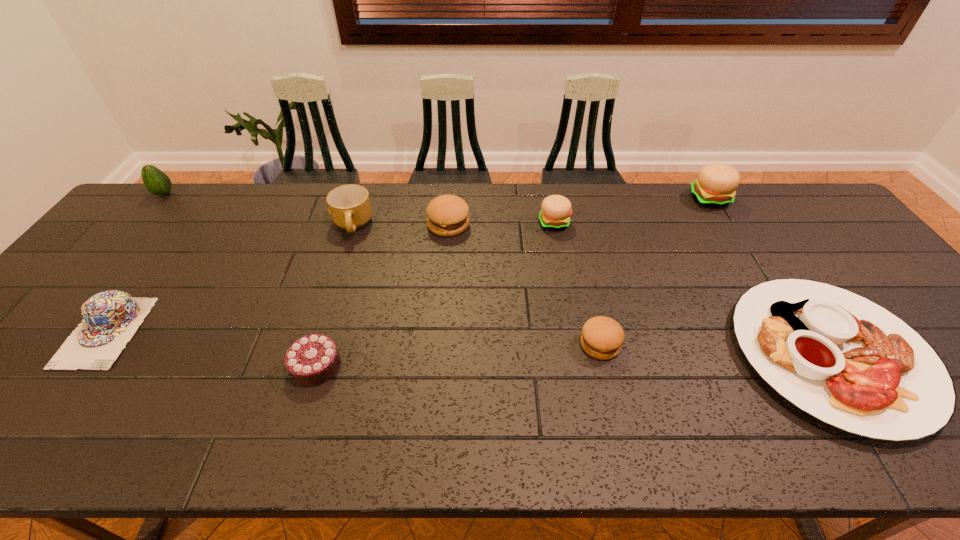
At what (x,y) coordinates should I click in order to perform the action: click on the right beige hamburger. Please return your answer as a coordinate pair (x, y). Looking at the image, I should click on (716, 184).

Find the location of a particular element. The width and height of the screenshot is (960, 540). the rightmost hamburger is located at coordinates (716, 184).

Find the location of a particular element. the leftmost object is located at coordinates (156, 181).

Locate an element on the screen. The height and width of the screenshot is (540, 960). green avocado is located at coordinates (156, 181).

I want to click on mug, so click(350, 208).

Identify the location of the bigger brown hamburger. The width and height of the screenshot is (960, 540). (447, 214).

Image resolution: width=960 pixels, height=540 pixels. In order to click on the farther brown hamburger in this screenshot , I will do `click(447, 214)`.

Where is `the smaller beige hamburger`? the smaller beige hamburger is located at coordinates (555, 212).

You are a GUI agent. You are given a task and a screenshot of the screen. Output one action in this format:
    pyautogui.click(x=<x>, y=<y>)
    Task: Click on the left beige hamburger
    This screenshot has width=960, height=540.
    Given the screenshot: What is the action you would take?
    pyautogui.click(x=555, y=212)

Where is `the eighth object from right to left`? the eighth object from right to left is located at coordinates (111, 318).